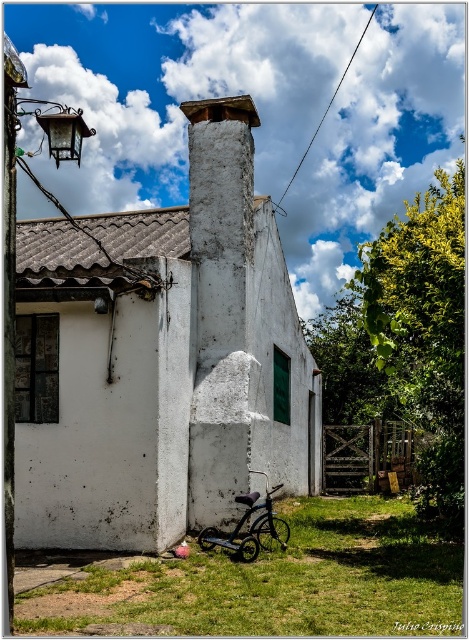
Question: Which point is farther to the camera?

Choices:
 (A) white rough concrete chimney at center
 (B) shiny black bicycle at lower center

Answer: (A)

Question: Is the position of green grass at lower center more distant than that of white rough concrete chimney at center?

Choices:
 (A) no
 (B) yes

Answer: (A)

Question: Can you confirm if white rough concrete chimney at center is positioned above shiny black bicycle at lower center?

Choices:
 (A) no
 (B) yes

Answer: (B)

Question: Is white rough concrete chimney at center wider than shiny black bicycle at lower center?

Choices:
 (A) no
 (B) yes

Answer: (B)

Question: Estimate the real-world distances between objects in this image. Which object is closer to the green grass at lower center?

Choices:
 (A) white rough concrete chimney at center
 (B) shiny black bicycle at lower center

Answer: (B)

Question: Which object is the farthest from the shiny black bicycle at lower center?

Choices:
 (A) green grass at lower center
 (B) white rough concrete chimney at center

Answer: (B)